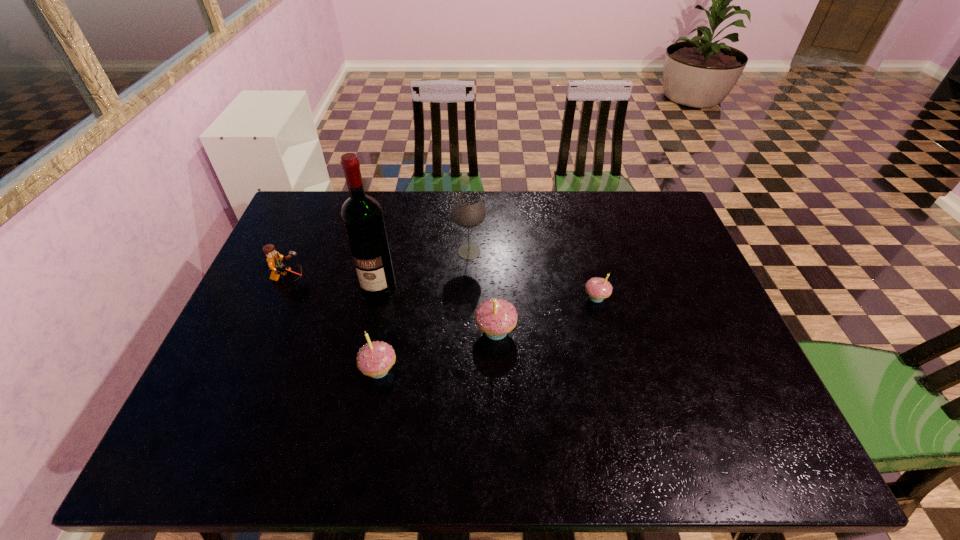
Please point out where to position a new cupcake on the right to maintain spacing. Please provide its 2D coordinates. Your answer should be formatted as a tuple, i.e. [(x, y)], where the tuple contains the x and y coordinates of a point satisfying the conditions above.

[(684, 268)]